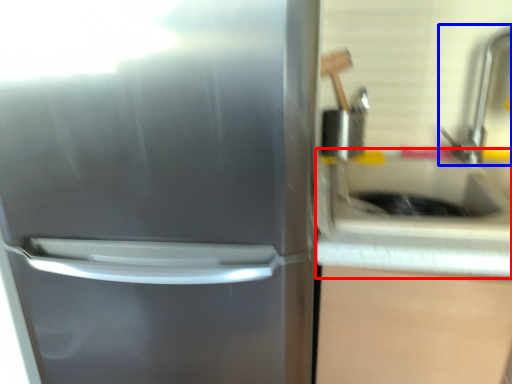
Question: Which of the following is the farthest to the observer, counter top (highlighted by a red box) or faucet (highlighted by a blue box)?

Choices:
 (A) counter top
 (B) faucet

Answer: (B)